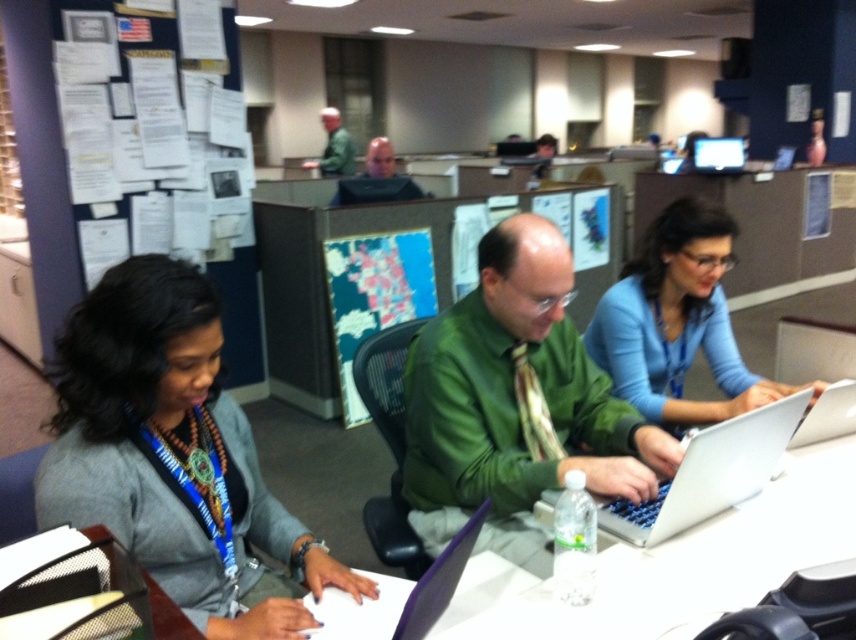
Does green textured tie at center appear over bald head at center?

No.

Between green textured tie at center and bald head at center, which one is positioned lower?

green textured tie at center is below.

Which is in front, point (510, 355) or point (405, 195)?

Point (510, 355)

Identify the location of green textured tie at center. This screenshot has height=640, width=856. (533, 410).

Which is more to the left, purple matte laptop at center or bald head at center?

bald head at center

Is purple matte laptop at center to the right of bald head at center from the viewer's perspective?

Correct, you'll find purple matte laptop at center to the right of bald head at center.

Which is in front, point (348, 628) or point (383, 156)?

Positioned in front is point (348, 628).

Identify the location of purple matte laptop at center. This screenshot has width=856, height=640. (401, 596).

Between point (94, 316) and point (406, 198), which one is positioned behind?

Positioned behind is point (406, 198).

You are a GUI agent. You are given a task and a screenshot of the screen. Output one action in this format:
    pyautogui.click(x=<x>, y=<y>)
    Task: Click on the gray fabric jacket at lower left
    The width and height of the screenshot is (856, 640).
    Given the screenshot: What is the action you would take?
    pyautogui.click(x=174, y=456)